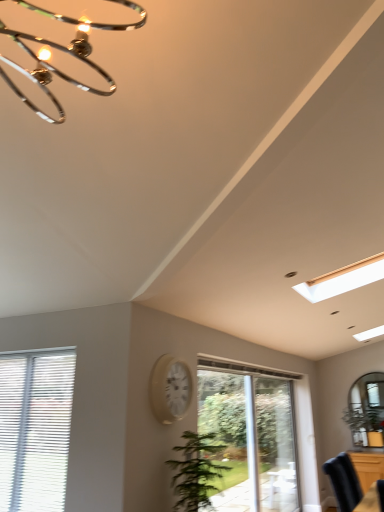
Question: Is white blinds at lower left, positioned as the second window in right-to-left order, in front of or behind clear glass door at center in the image?

Choices:
 (A) behind
 (B) front

Answer: (B)

Question: Does point (6, 410) appear closer or farther from the camera than point (264, 456)?

Choices:
 (A) closer
 (B) farther

Answer: (A)

Question: Which is nearer to the brown wooden dresser at lower right?

Choices:
 (A) white glossy clock at center
 (B) clear glass door at center
 (C) clear glass door at center, the second window when ordered from front to back
 (D) white blinds at lower left, acting as the 1th window starting from the front
 (E) green leafy plant at center

Answer: (B)

Question: Based on their relative distances, which object is farther from the white blinds at lower left, marked as the second window in a back-to-front arrangement?

Choices:
 (A) green leafy plant at center
 (B) white glossy clock at center
 (C) clear glass door at center
 (D) brown wooden dresser at lower right
 (E) clear glass door at center, the first window positioned from the back

Answer: (D)